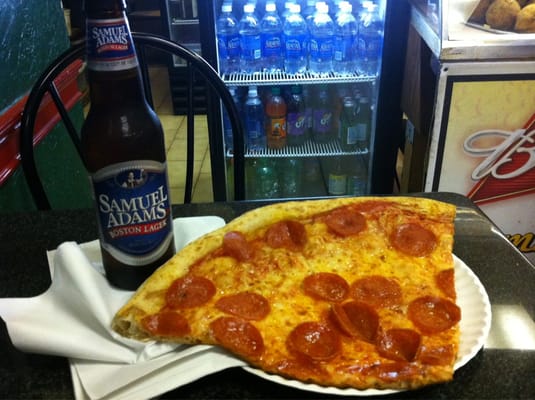
The image size is (535, 400). I want to click on tile floor behind chair, so click(179, 145).